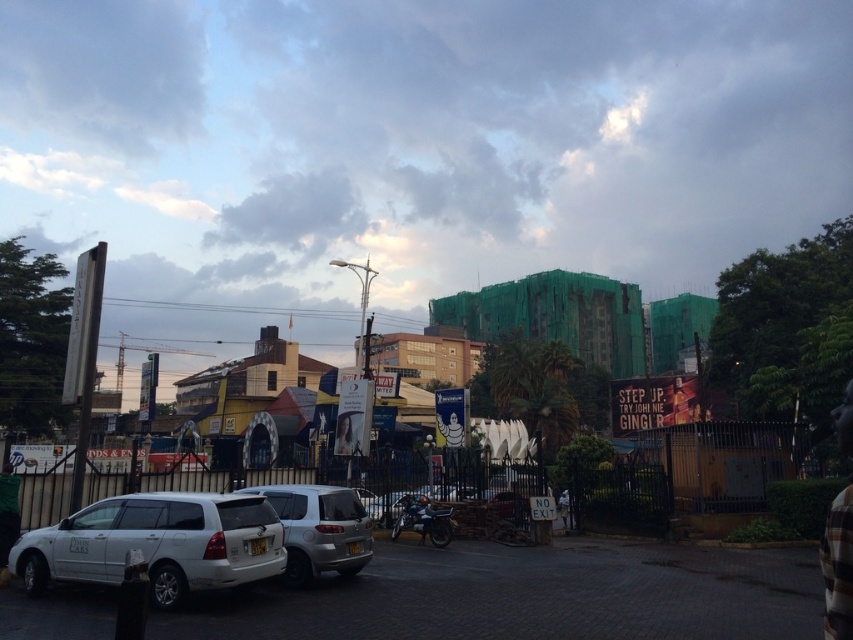
You are a delivery driver who needs to back out of a parking spot between the white matte van at lower left and the satin silver suv at center. The space between them is narrow. Can you safely maneuver your truck, which is 2.2 meters wide, through this gap?

The gap between the white matte van at lower left and the satin silver suv at center is 1.75 meters, which is narrower than your truck width of 2.2 meters. Therefore, you cannot safely maneuver your truck through this gap.

You are a pedestrian trying to cross the road from the left side. You see the white matte van at lower left and the satin silver suv at center. Which vehicle is closer to you as you start crossing?

The white matte van at lower left is closer to you because it is positioned in front of the satin silver suv at center, meaning it is nearer to your starting point on the left side of the road.